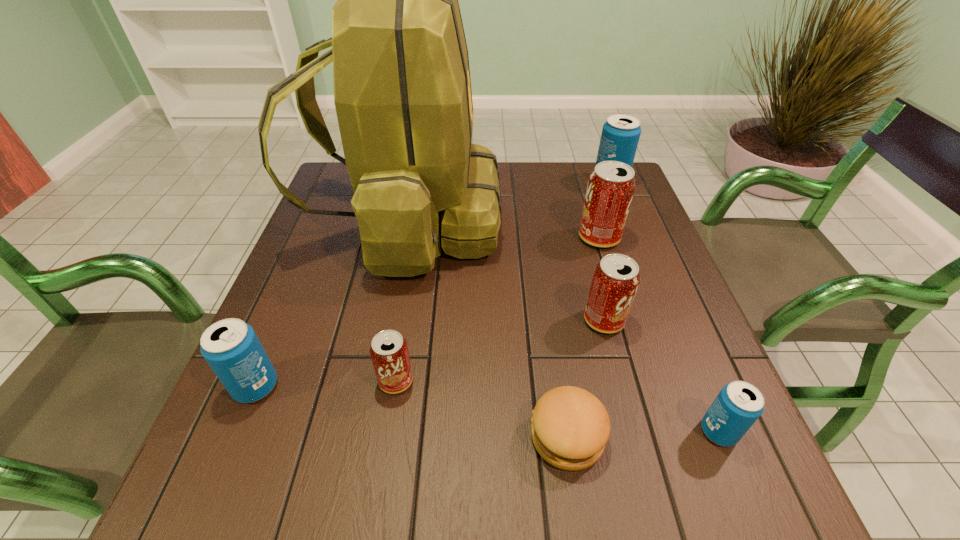
The width and height of the screenshot is (960, 540). Identify the location of backpack. (402, 90).

Image resolution: width=960 pixels, height=540 pixels. I want to click on the biggest blue soda can, so click(620, 135).

Where is `the farthest blue soda can`? the farthest blue soda can is located at coordinates (620, 135).

You are a GUI agent. You are given a task and a screenshot of the screen. Output one action in this format:
    pyautogui.click(x=<x>, y=<y>)
    Task: Click on the second farthest soda can
    This screenshot has height=540, width=960.
    Given the screenshot: What is the action you would take?
    pyautogui.click(x=611, y=186)

Where is `the biggest red soda can`? the biggest red soda can is located at coordinates (611, 186).

Where is `the second farthest red soda can`? This screenshot has width=960, height=540. the second farthest red soda can is located at coordinates (615, 281).

This screenshot has height=540, width=960. Find the location of `the fourth farthest object`. the fourth farthest object is located at coordinates (615, 281).

The image size is (960, 540). Identify the location of the leftmost soda can. (231, 347).

Locate an element on the screen. The image size is (960, 540). the second farthest blue soda can is located at coordinates (231, 347).

Where is `the nearest red soda can`? the nearest red soda can is located at coordinates (389, 352).